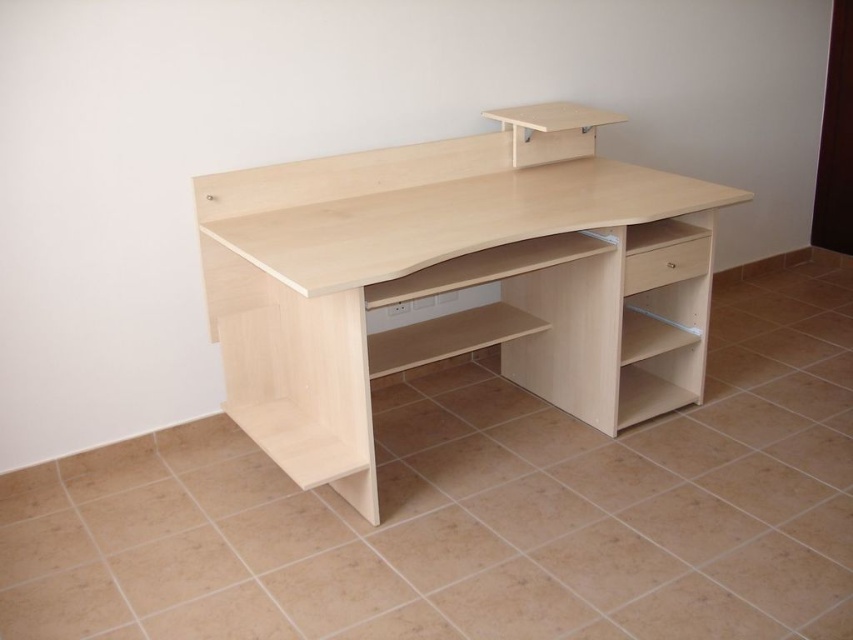
Can you confirm if light wood computer desk at center is bigger than light wood drawer at right?

Correct, light wood computer desk at center is larger in size than light wood drawer at right.

Measure the distance from light wood computer desk at center to light wood drawer at right.

light wood computer desk at center and light wood drawer at right are 18.37 inches apart from each other.

Find the location of a particular element. The height and width of the screenshot is (640, 853). light wood computer desk at center is located at coordinates (448, 284).